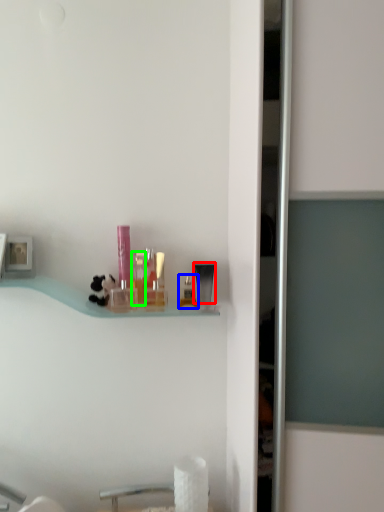
Question: Considering the real-world distances, which object is farthest from toiletry (highlighted by a red box)? toiletry (highlighted by a blue box) or toiletry (highlighted by a green box)?

Choices:
 (A) toiletry
 (B) toiletry

Answer: (B)